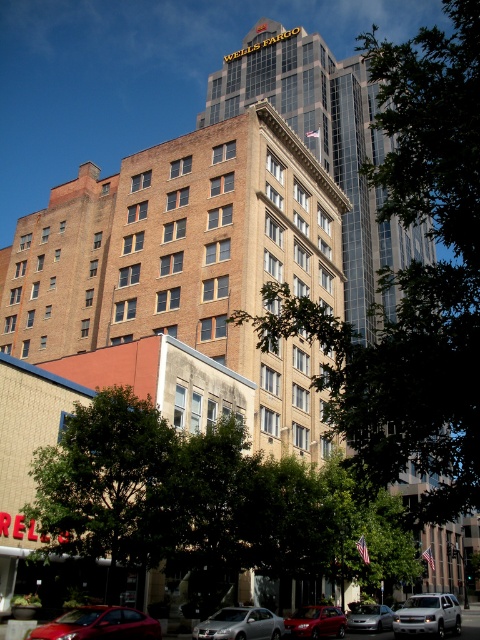
Is point (447, 628) in front of point (369, 616)?

Yes, it is.

Which is below, white matte suv at lower right or satin silver sedan at lower center?

white matte suv at lower right is lower down.

This screenshot has height=640, width=480. Identify the location of white matte suv at lower right. tap(428, 616).

Is point (59, 628) positioned behind point (292, 620)?

No, it is in front of (292, 620).

Does shiny red sedan at lower left have a greater height compared to shiny red sedan at lower center?

Incorrect, shiny red sedan at lower left's height is not larger of shiny red sedan at lower center's.

You are a GUI agent. You are given a task and a screenshot of the screen. Output one action in this format:
    pyautogui.click(x=<x>, y=<y>)
    Task: Click on the shiny red sedan at lower left
    The height and width of the screenshot is (640, 480).
    Given the screenshot: What is the action you would take?
    pyautogui.click(x=98, y=625)

Between point (92, 627) and point (442, 628), which one is positioned behind?

The point (442, 628) is more distant.

Is shiny red sedan at lower left above white matte suv at lower right?

Correct, shiny red sedan at lower left is located above white matte suv at lower right.

Who is more distant from viewer, (81, 628) or (405, 627)?

The point (405, 627) is behind.

Find the location of `shiny red sedan at lower left`. shiny red sedan at lower left is located at coordinates 98,625.